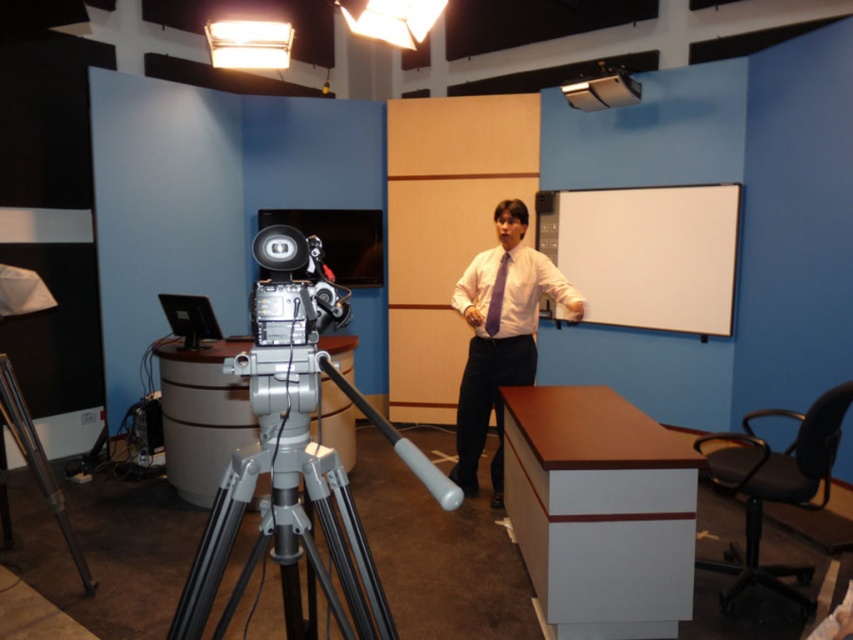
Question: Which object appears closest to the camera in this image?

Choices:
 (A) purple matte shirt at center
 (B) white matte dress shirt at center

Answer: (A)

Question: Can you confirm if white matte projection screen at upper right is smaller than purple satin tie at center?

Choices:
 (A) yes
 (B) no

Answer: (B)

Question: Which point is farther to the camera?

Choices:
 (A) white matte projection screen at upper right
 (B) metallic projector at upper right
 (C) purple matte shirt at center

Answer: (B)

Question: Which point is farther to the camera?

Choices:
 (A) (524, 275)
 (B) (508, 257)
 (C) (490, 392)
 (D) (605, 237)

Answer: (D)

Question: Does metallic projector at upper right appear on the left side of purple satin tie at center?

Choices:
 (A) yes
 (B) no

Answer: (B)

Question: Does white matte projection screen at upper right have a greater width compared to purple satin tie at center?

Choices:
 (A) no
 (B) yes

Answer: (B)